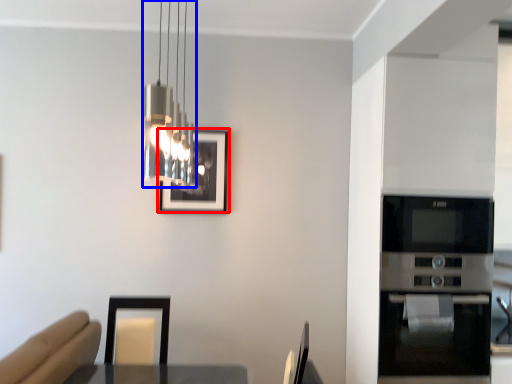
Question: Which object is further to the camera taking this photo, picture frame (highlighted by a red box) or lamp (highlighted by a blue box)?

Choices:
 (A) picture frame
 (B) lamp

Answer: (A)